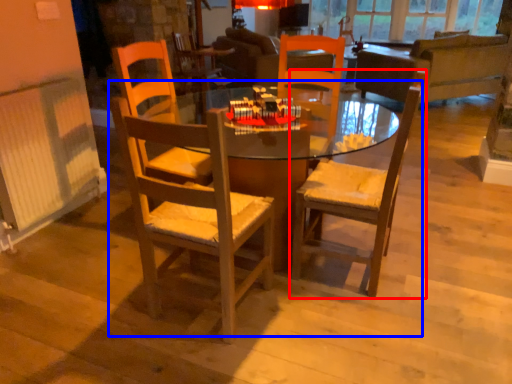
Question: Which point is closer to the camera, chair (highlighted by a red box) or kitchen & dining room table (highlighted by a blue box)?

Choices:
 (A) chair
 (B) kitchen & dining room table

Answer: (B)